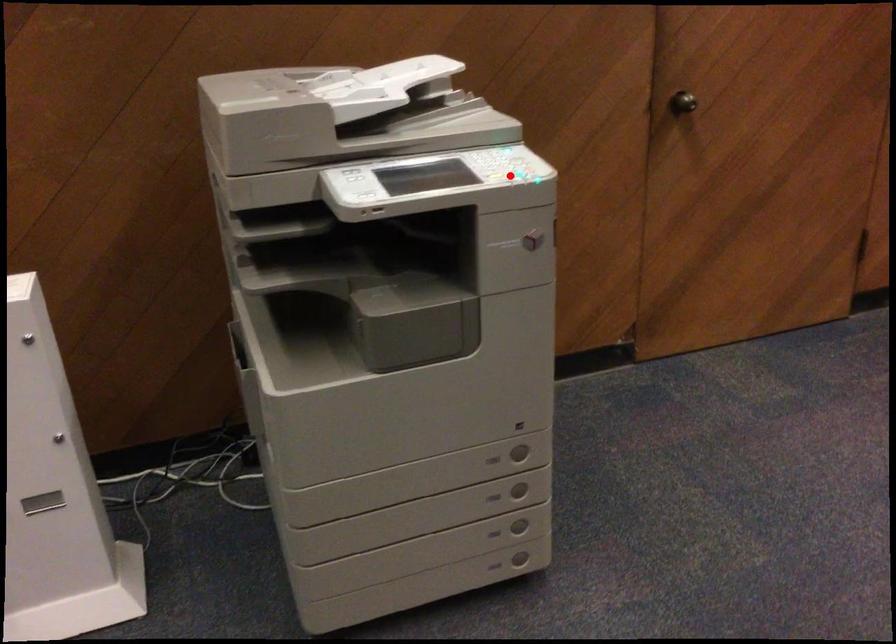
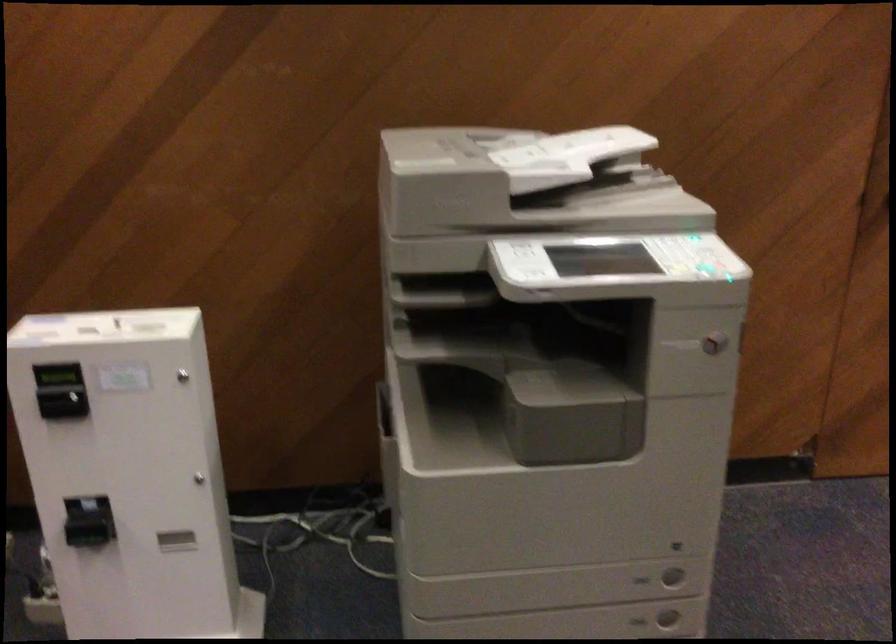
Question: I am providing you with two images of the same scene from different viewpoints. In image1, a red point is highlighted. Considering the same 3D point in image2, which of the following is correct?

Choices:
 (A) It is closer
 (B) It is farther

Answer: (A)